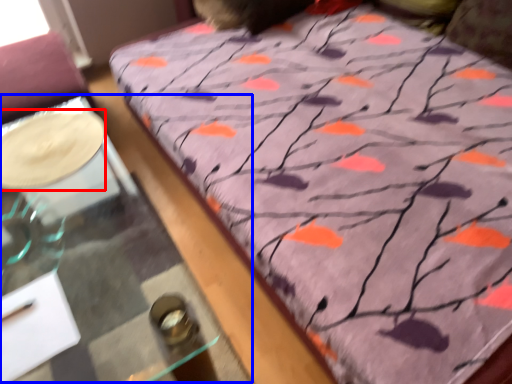
Question: Which point is further to the camera, glass plate (highlighted by a red box) or table (highlighted by a blue box)?

Choices:
 (A) glass plate
 (B) table

Answer: (A)